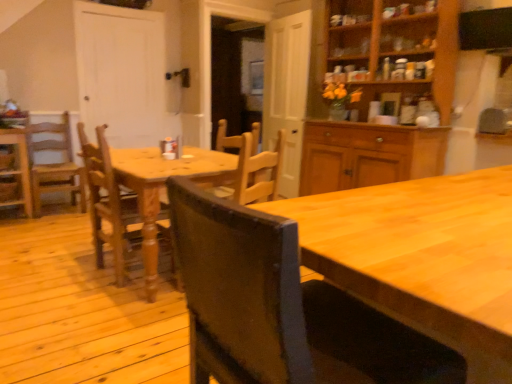
Identify the location of free spot below light brown wooden chair at left, placed as the second chair when sorted from left to right (from a real-world perspective). The height and width of the screenshot is (384, 512). (57, 211).